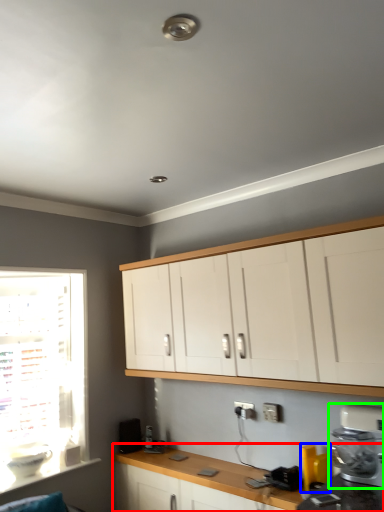
Question: Based on their relative distances, which object is nearer to countertop (highlighted by a red box)? Choose from appliance (highlighted by a blue box) and kitchen appliance (highlighted by a green box).

Choices:
 (A) appliance
 (B) kitchen appliance

Answer: (A)